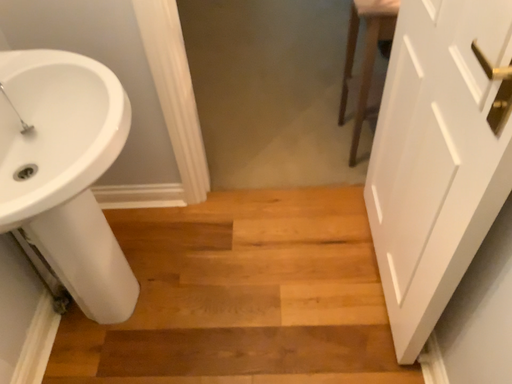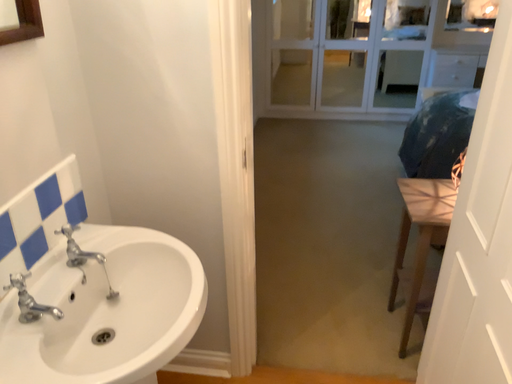
Question: Which way did the camera rotate in the video?

Choices:
 (A) rotated upward
 (B) rotated downward

Answer: (A)